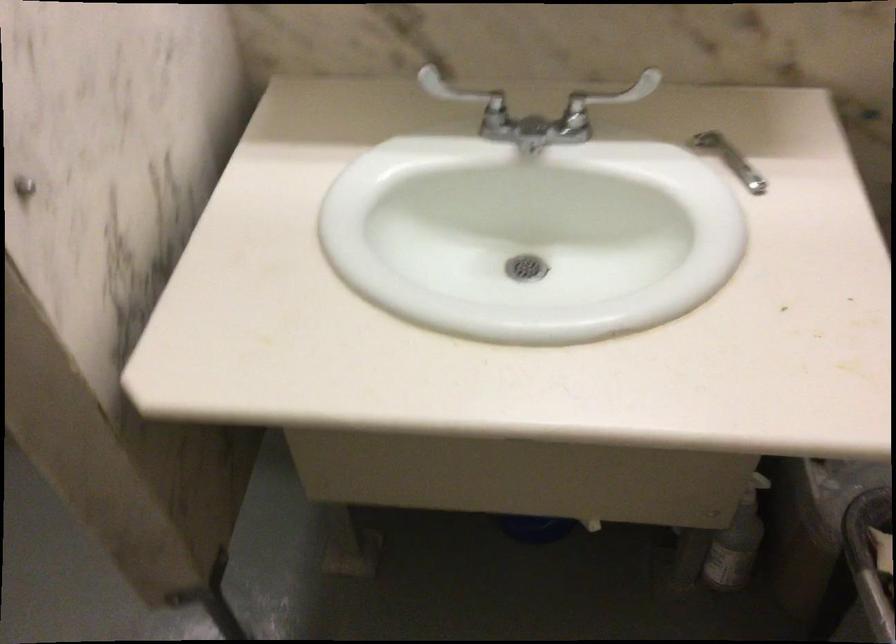
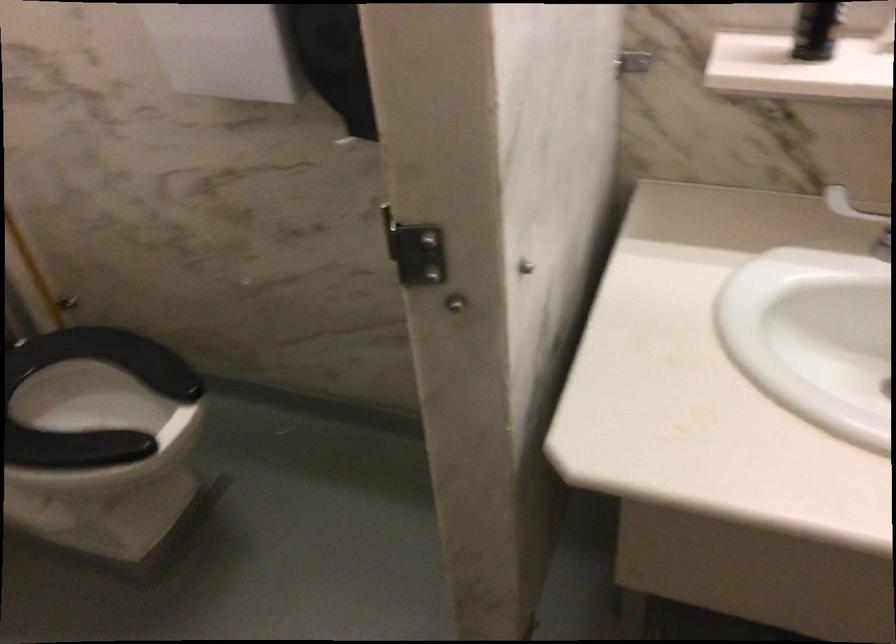
Question: How did the camera likely rotate?

Choices:
 (A) Left
 (B) Right
 (C) Up
 (D) Down

Answer: (A)